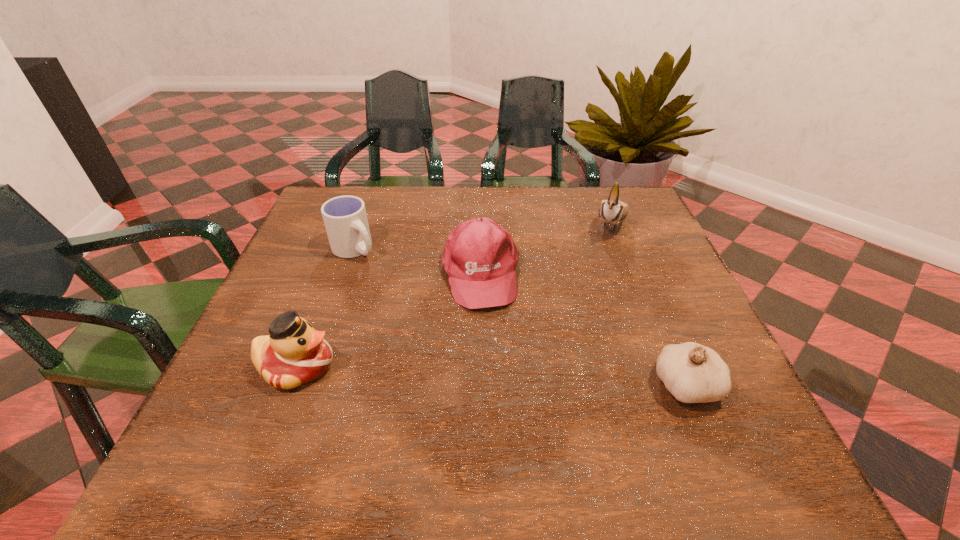
The height and width of the screenshot is (540, 960). What are the coordinates of `vacant space that satisfies the following two spatial constraints: 1. on the front side of the garlic; 2. on the right side of the tallest object` in the screenshot? It's located at (674, 386).

At what (x,y) coordinates should I click in order to perform the action: click on free space that satisfies the following two spatial constraints: 1. on the back side of the tallest object; 2. on the right side of the third object from right to left. Please return your answer as a coordinate pair (x, y). Looking at the image, I should click on (480, 224).